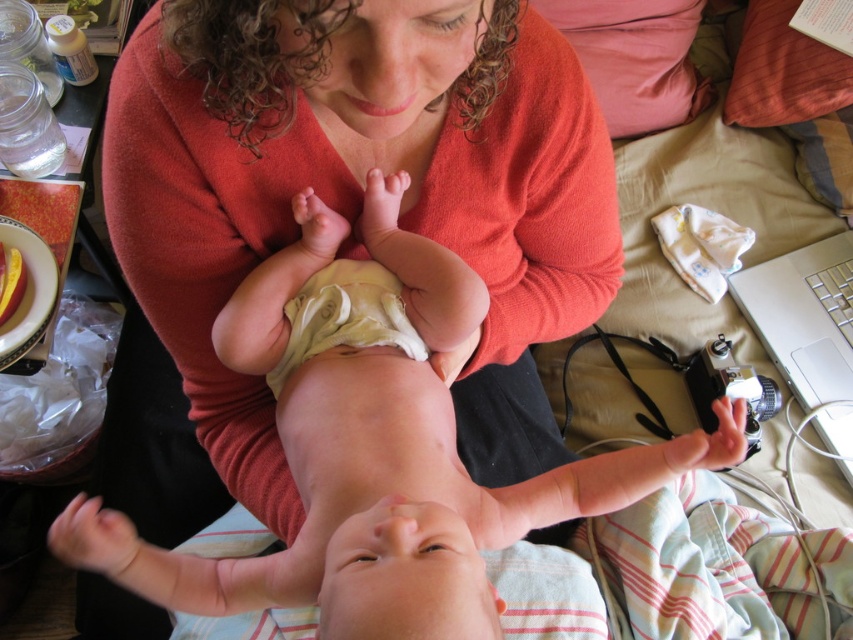
You are a photographer setting up for a photo shoot in the living room. You have a silver metallic laptop at lower right and a light yellow cloth diaper at center. Which object is wider?

The silver metallic laptop at lower right is wider than the light yellow cloth diaper at center.

You are a photographer trying to decide whether to place a matte orange sweater at center and a soft beige diaper at center on a shelf. The shelf has limited space, and you need to know which object takes up more space. Based on the scene, which object should you place first to optimize space?

The matte orange sweater at center has a larger size compared to the soft beige diaper at center, so you should place the matte orange sweater at center first to optimize space.

You are a photographer adjusting your camera setup in the room. You notice two points marked in the scene. The first point is at coordinates point (276,504) and the second is at point (422,609). Which point is closer to you?

Point (276,504) is further to the viewer than point (422,609), so the second point is closer to you.